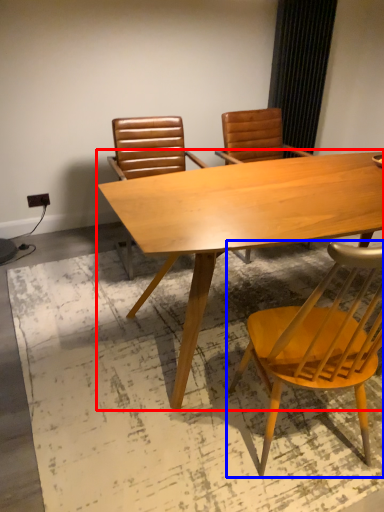
Question: Among these objects, which one is nearest to the camera, table (highlighted by a red box) or chair (highlighted by a blue box)?

Choices:
 (A) table
 (B) chair

Answer: (B)